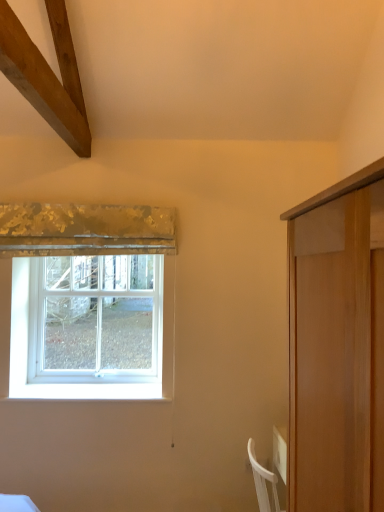
Question: Considering the relative sizes of gold textured fabric at upper left and white plastic window at left in the image provided, is gold textured fabric at upper left smaller than white plastic window at left?

Choices:
 (A) no
 (B) yes

Answer: (B)

Question: Considering the relative positions of gold textured fabric at upper left and white plastic window at left in the image provided, is gold textured fabric at upper left in front of white plastic window at left?

Choices:
 (A) no
 (B) yes

Answer: (B)

Question: From a real-world perspective, is gold textured fabric at upper left located higher than white plastic window at left?

Choices:
 (A) no
 (B) yes

Answer: (B)

Question: From the image's perspective, is gold textured fabric at upper left below white plastic window at left?

Choices:
 (A) yes
 (B) no

Answer: (B)

Question: From the image's perspective, does gold textured fabric at upper left appear higher than white plastic window at left?

Choices:
 (A) yes
 (B) no

Answer: (A)

Question: Are gold textured fabric at upper left and white plastic window at left located far from each other?

Choices:
 (A) no
 (B) yes

Answer: (A)

Question: Does white plastic window at left touch gold textured fabric at upper left?

Choices:
 (A) no
 (B) yes

Answer: (A)

Question: Is white plastic window at left positioned beyond the bounds of gold textured fabric at upper left?

Choices:
 (A) yes
 (B) no

Answer: (A)

Question: Is white plastic window at left closer to camera compared to gold textured fabric at upper left?

Choices:
 (A) yes
 (B) no

Answer: (B)

Question: Does white plastic window at left have a smaller size compared to gold textured fabric at upper left?

Choices:
 (A) no
 (B) yes

Answer: (A)

Question: Is white plastic window at left at the right side of gold textured fabric at upper left?

Choices:
 (A) no
 (B) yes

Answer: (A)

Question: From a real-world perspective, is white plastic window at left beneath gold textured fabric at upper left?

Choices:
 (A) yes
 (B) no

Answer: (A)

Question: Considering the positions of white plastic window at left and gold textured fabric at upper left in the image, is white plastic window at left taller or shorter than gold textured fabric at upper left?

Choices:
 (A) short
 (B) tall

Answer: (B)